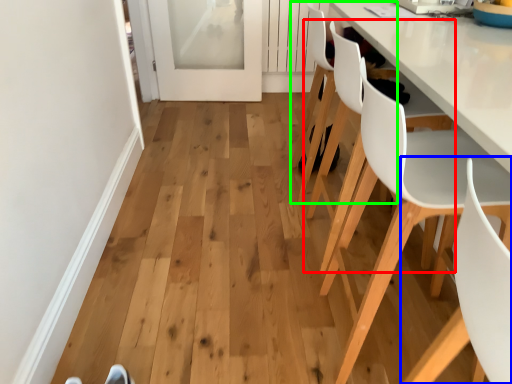
Question: Which is farther away from chair (highlighted by a red box)? chair (highlighted by a blue box) or chair (highlighted by a green box)?

Choices:
 (A) chair
 (B) chair

Answer: (A)